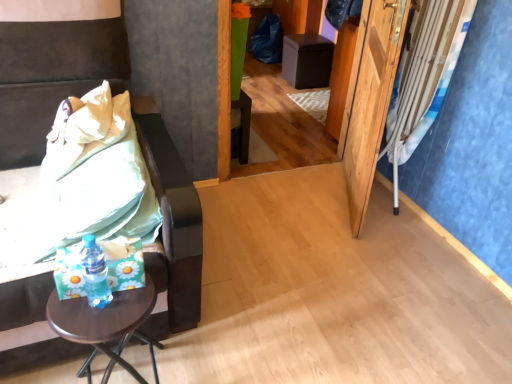
Where is `free space to the left of blue fabric curtain at right`? free space to the left of blue fabric curtain at right is located at coordinates (346, 193).